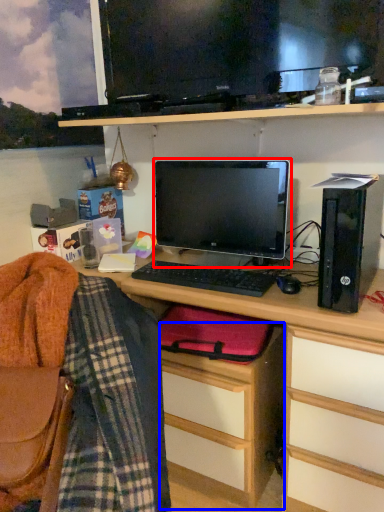
Question: Which object appears closest to the camera in this image, computer monitor (highlighted by a red box) or file cabinet (highlighted by a blue box)?

Choices:
 (A) computer monitor
 (B) file cabinet

Answer: (B)